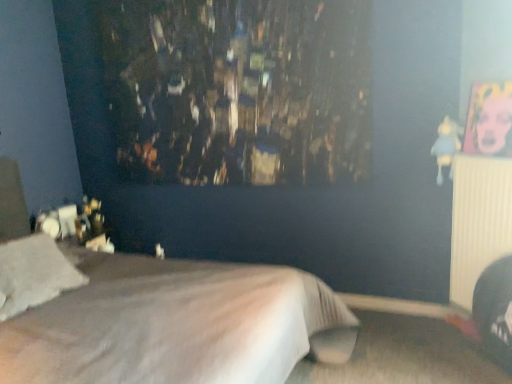
Where is `empty space that is ontop of white ribbed radiator at right (from a real-world perspective)`? The image size is (512, 384). empty space that is ontop of white ribbed radiator at right (from a real-world perspective) is located at coordinates (490, 153).